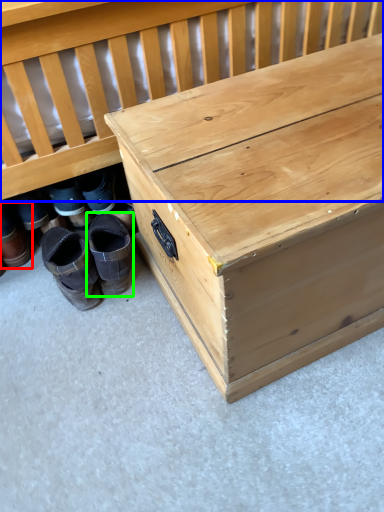
Question: Based on their relative distances, which object is farther from footwear (highlighted by a red box)? Choose from infant bed (highlighted by a blue box) and footwear (highlighted by a green box).

Choices:
 (A) infant bed
 (B) footwear

Answer: (A)